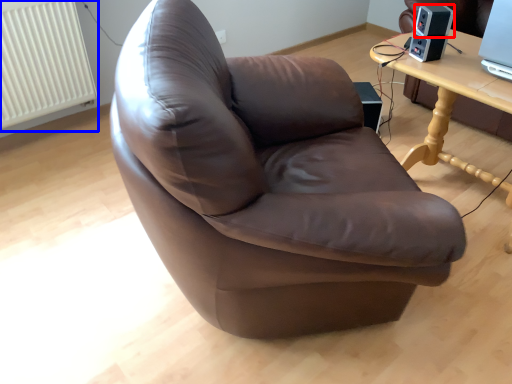
Question: Which point is further to the camera, speaker (highlighted by a red box) or radiator (highlighted by a blue box)?

Choices:
 (A) speaker
 (B) radiator

Answer: (B)